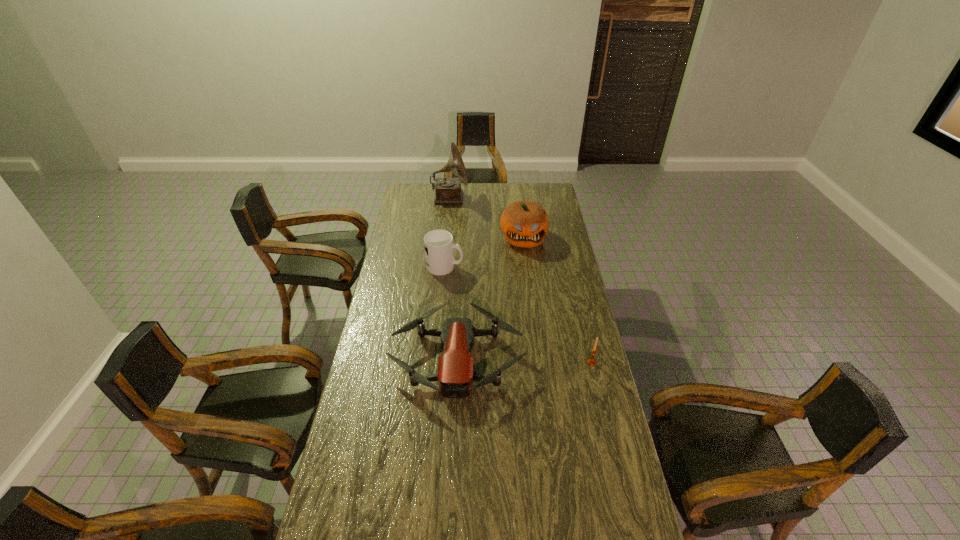
Locate an element on the screen. The width and height of the screenshot is (960, 540). vacant space located 0.110m on the face of the fourth shortest object is located at coordinates (527, 265).

Identify the location of vacant region located on the handle side of the third nearest object. (505, 266).

The height and width of the screenshot is (540, 960). In order to click on vacant area located 0.170m on the back of the rightmost object in this screenshot , I will do `click(583, 326)`.

The height and width of the screenshot is (540, 960). Find the location of `blank space located on the front-facing side of the shortest object`. blank space located on the front-facing side of the shortest object is located at coordinates (452, 456).

At what (x,y) coordinates should I click in order to perform the action: click on object that is at the far edge. Please return your answer as a coordinate pair (x, y). Looking at the image, I should click on (448, 190).

Find the location of a particular element. The image size is (960, 540). object that is at the left edge is located at coordinates (455, 374).

Locate an element on the screen. This screenshot has width=960, height=540. pumpkin situated at the right edge is located at coordinates (524, 224).

The height and width of the screenshot is (540, 960). I want to click on candle_holder located in the right edge section of the desktop, so click(591, 361).

Locate an element on the screen. free space at the far edge is located at coordinates click(519, 190).

In the image, there is a desktop. Where is `vacant space at the left edge`? The width and height of the screenshot is (960, 540). vacant space at the left edge is located at coordinates (367, 388).